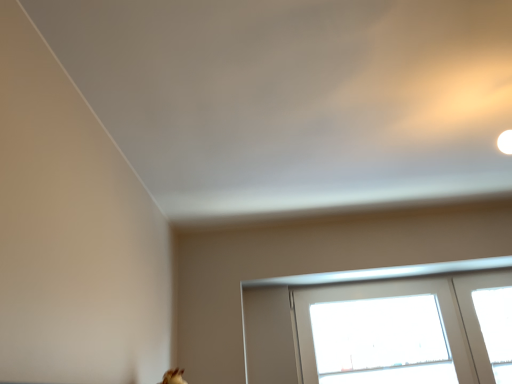
The height and width of the screenshot is (384, 512). What do you see at coordinates (394, 328) in the screenshot?
I see `white plastic window at lower right` at bounding box center [394, 328].

This screenshot has width=512, height=384. I want to click on white plastic window at lower right, so click(394, 328).

Locate an element on the screen. The width and height of the screenshot is (512, 384). white plastic window at lower right is located at coordinates (394, 328).